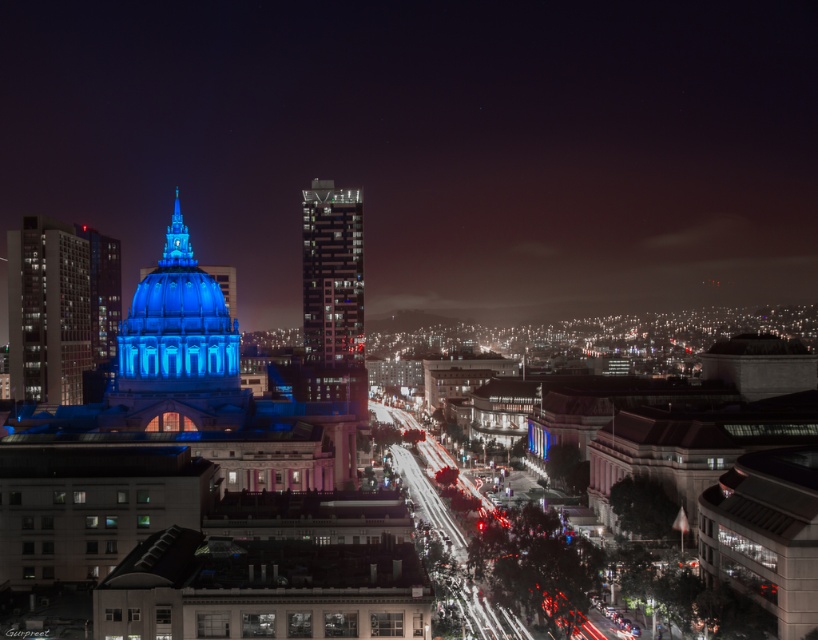
Question: Is blue glass dome at center wider than matte glass skyscraper at left?

Choices:
 (A) no
 (B) yes

Answer: (B)

Question: Does blue glass dome at center have a larger size compared to glassy reflective skyscraper at center?

Choices:
 (A) yes
 (B) no

Answer: (B)

Question: Is blue glass dome at center closer to camera compared to matte glass skyscraper at left?

Choices:
 (A) yes
 (B) no

Answer: (A)

Question: Which object appears closest to the camera in this image?

Choices:
 (A) matte glass skyscraper at left
 (B) blue glass dome at center
 (C) glassy reflective skyscraper at center

Answer: (B)

Question: Among these objects, which one is farthest from the camera?

Choices:
 (A) glassy reflective skyscraper at center
 (B) matte glass skyscraper at left

Answer: (A)

Question: Which object appears closest to the camera in this image?

Choices:
 (A) matte glass skyscraper at left
 (B) blue glass dome at center

Answer: (B)